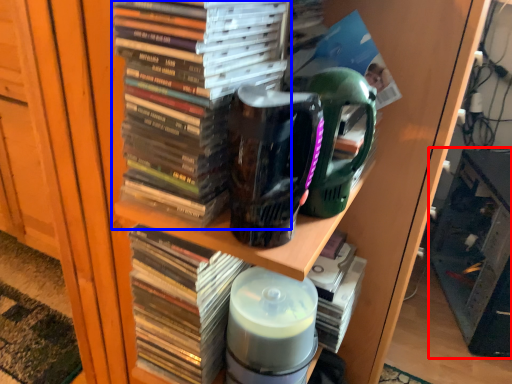
Question: Which object is closer to the camera taking this photo, shelf (highlighted by a red box) or book (highlighted by a blue box)?

Choices:
 (A) shelf
 (B) book

Answer: (B)